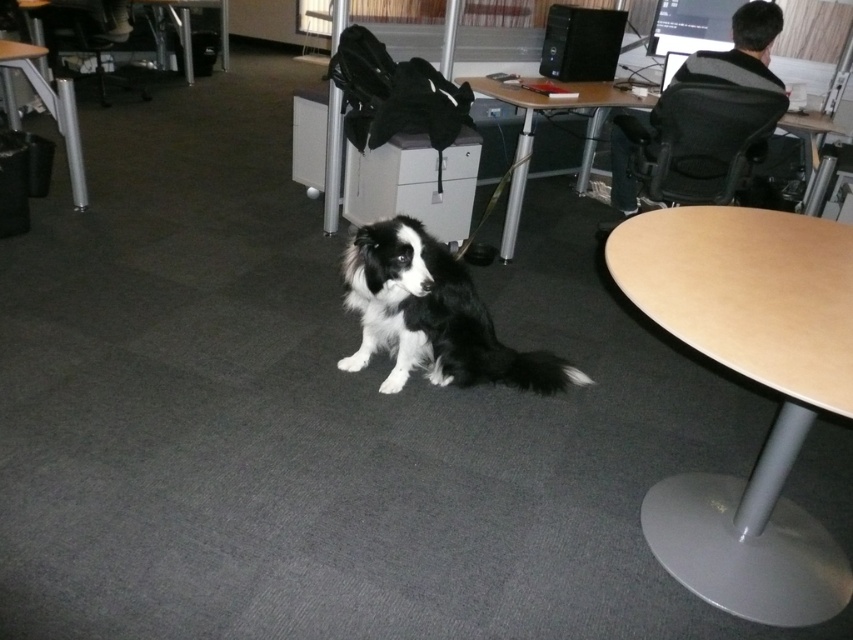
Where is `black/white fur dog at center`? black/white fur dog at center is located at coordinates (432, 316).

Does black/white fur dog at center appear over metallic black chair at upper left?

Actually, black/white fur dog at center is below metallic black chair at upper left.

Between point (451, 332) and point (91, 51), which one is positioned in front?

Point (451, 332) is more forward.

Find the location of a particular element. Image resolution: width=853 pixels, height=640 pixels. black/white fur dog at center is located at coordinates (432, 316).

Between black/white fur dog at center and wooden table at upper center, which one is positioned higher?

wooden table at upper center is above.

Which is more to the right, black/white fur dog at center or wooden table at upper center?

From the viewer's perspective, wooden table at upper center appears more on the right side.

Which is behind, point (486, 364) or point (595, 109)?

The point (595, 109) is behind.

Find the location of a particular element. black/white fur dog at center is located at coordinates (432, 316).

Who is shorter, light brown wood round table at lower right or wooden table at upper center?

light brown wood round table at lower right

Which is in front, point (822, 220) or point (531, 131)?

Point (822, 220)

At what (x,y) coordinates should I click in order to perform the action: click on light brown wood round table at lower right. Please return your answer as a coordinate pair (x, y). The width and height of the screenshot is (853, 640). Looking at the image, I should click on (752, 380).